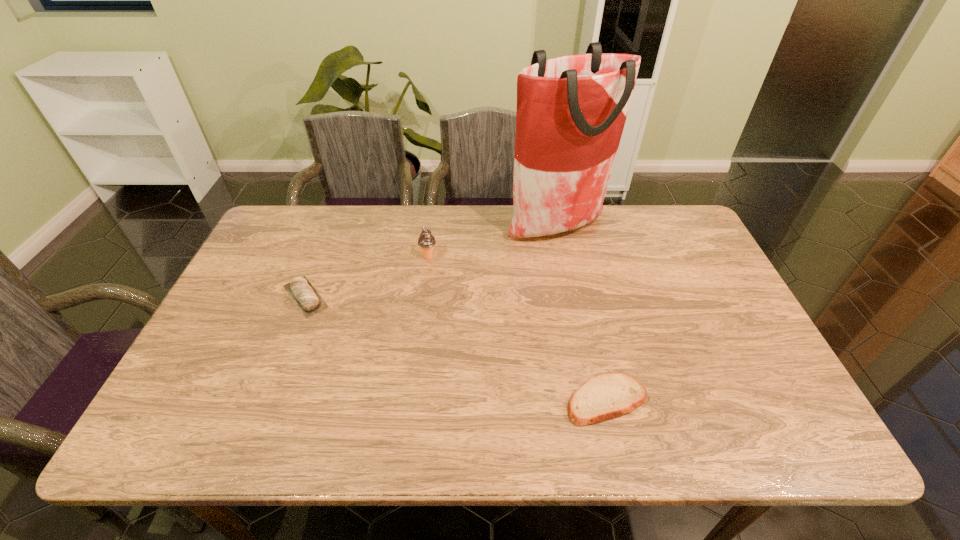
Locate an element on the screen. The image size is (960, 540). vacant space located on the left of the shorter pita bread is located at coordinates (443, 400).

At what (x,y) coordinates should I click in order to perform the action: click on object that is at the far edge. Please return your answer as a coordinate pair (x, y). The width and height of the screenshot is (960, 540). Looking at the image, I should click on (571, 111).

I want to click on object that is positioned at the near edge, so click(x=609, y=395).

Where is `object that is positioned at the left edge`? The image size is (960, 540). object that is positioned at the left edge is located at coordinates (307, 299).

Find the location of a particular element. free region at the far edge of the desktop is located at coordinates (575, 231).

This screenshot has height=540, width=960. I want to click on vacant area at the near edge of the desktop, so click(562, 429).

Locate an element on the screen. vacant space at the left edge is located at coordinates (252, 302).

At what (x,y) coordinates should I click in order to perform the action: click on free space at the right edge of the desktop. Please return your answer as a coordinate pair (x, y). This screenshot has width=960, height=540. Looking at the image, I should click on (751, 355).

This screenshot has height=540, width=960. I want to click on vacant space at the far left corner of the desktop, so click(x=270, y=242).

Where is `free space at the near left corner of the desktop`? This screenshot has width=960, height=540. free space at the near left corner of the desktop is located at coordinates (171, 410).